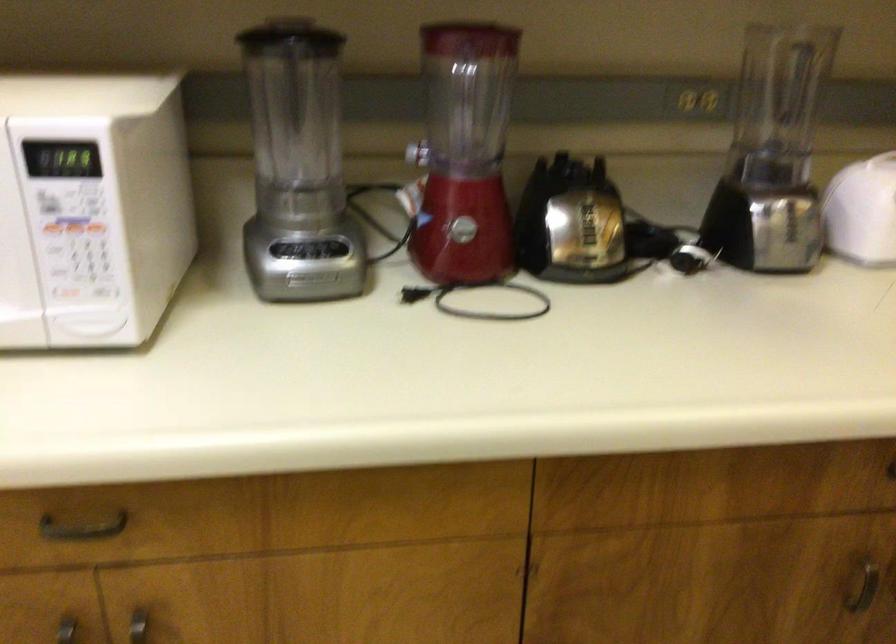
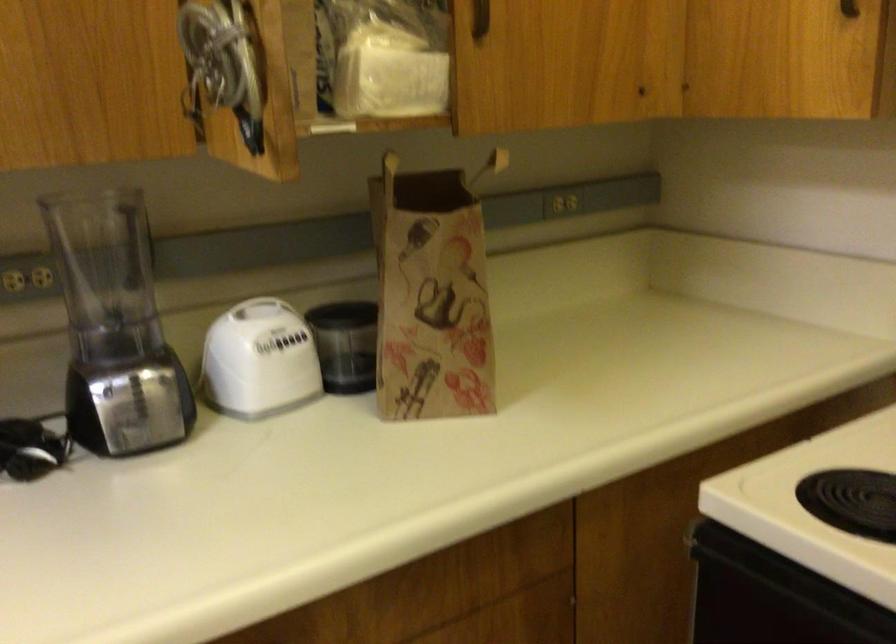
In the second image, find the point that corresponds to point 797,214 in the first image.

(149, 395)